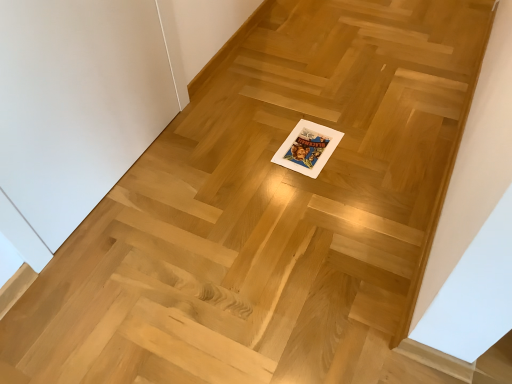
You are a GUI agent. You are given a task and a screenshot of the screen. Output one action in this format:
    pyautogui.click(x=<x>, y=<y>)
    Task: Click on the spots to the right of white paper at center
    This screenshot has width=512, height=384.
    Given the screenshot: What is the action you would take?
    pyautogui.click(x=362, y=146)